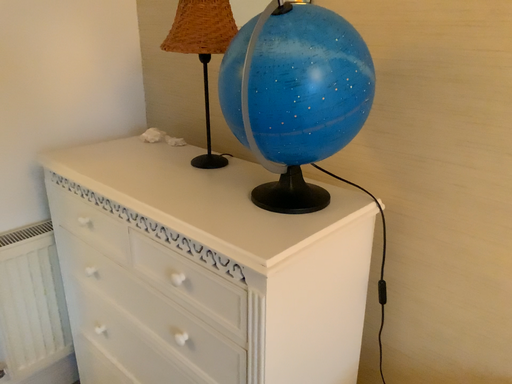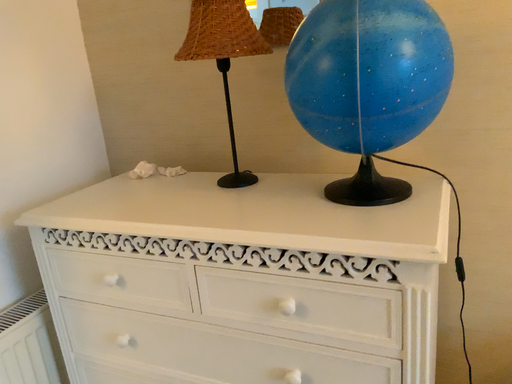
Question: How did the camera likely rotate when shooting the video?

Choices:
 (A) rotated right
 (B) rotated left

Answer: (A)